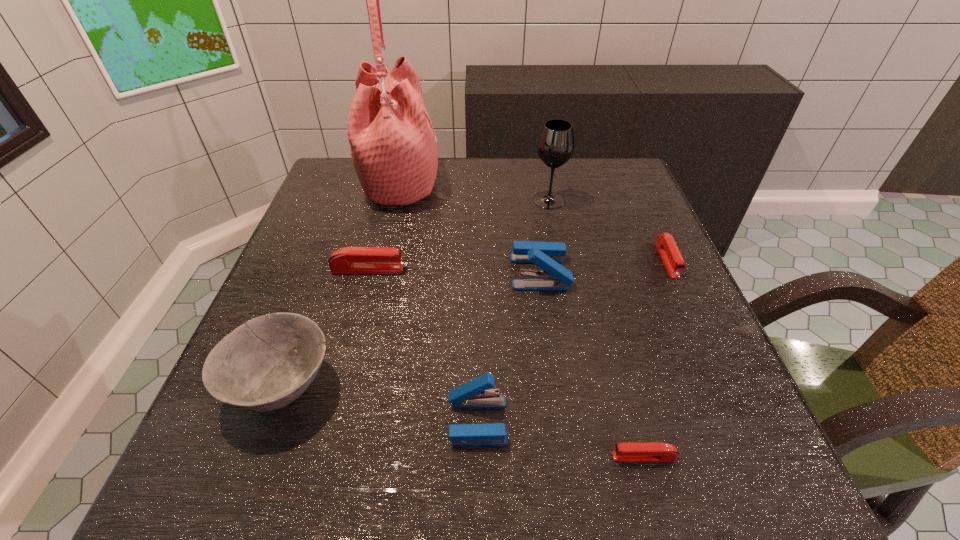
Identify the location of object at the near right corner. (648, 451).

The width and height of the screenshot is (960, 540). What are the coordinates of `vacant space at the far edge of the desktop` in the screenshot? It's located at (496, 198).

The height and width of the screenshot is (540, 960). Identify the location of free spot at the near edge of the desktop. (358, 475).

The height and width of the screenshot is (540, 960). Identify the location of vacant space at the left edge of the desktop. (296, 252).

This screenshot has height=540, width=960. What are the coordinates of `free space at the right edge of the desktop` in the screenshot? It's located at (724, 389).

Where is `vacant space at the far right corner of the desktop`? vacant space at the far right corner of the desktop is located at coordinates (618, 205).

In the image, there is a desktop. Identify the location of vacant space at the near right corner. Image resolution: width=960 pixels, height=540 pixels. (699, 503).

The height and width of the screenshot is (540, 960). What are the coordinates of `free space that is in between the tallest object and the leftmost red stapler` in the screenshot? It's located at (385, 226).

Identify the location of free space between the right blue stapler and the rightmost red stapler. (604, 266).

Where is `vacant point located between the right blue stapler and the sixth tallest object`? This screenshot has height=540, width=960. vacant point located between the right blue stapler and the sixth tallest object is located at coordinates (454, 271).